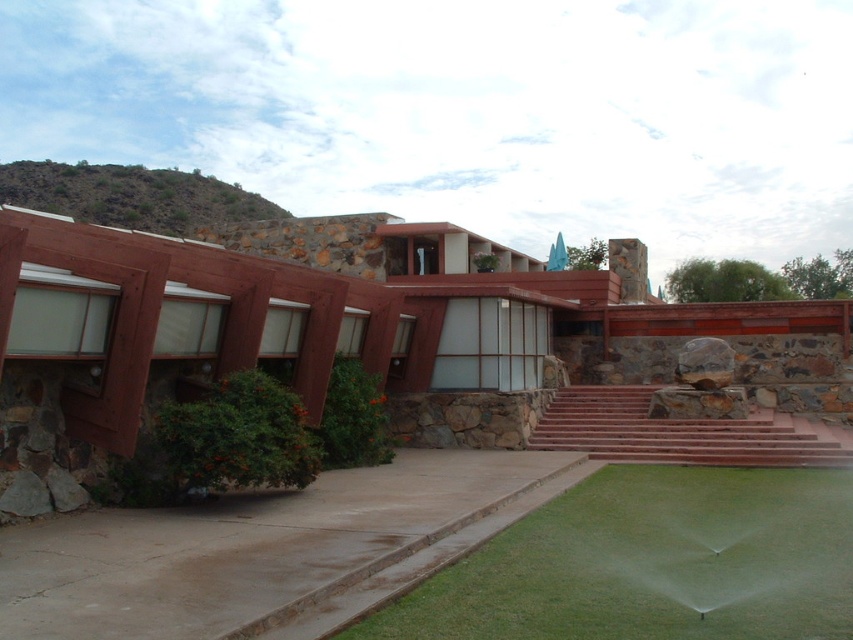
Question: Is brown wood pergola at center in front of green grass at lower center?

Choices:
 (A) no
 (B) yes

Answer: (A)

Question: Among these points, which one is farthest from the camera?

Choices:
 (A) (560, 634)
 (B) (646, 333)

Answer: (B)

Question: Which object appears farthest from the camera in this image?

Choices:
 (A) green grass at lower center
 (B) brown wood pergola at center

Answer: (B)

Question: Does brown wood pergola at center appear on the right side of green grass at lower center?

Choices:
 (A) no
 (B) yes

Answer: (A)

Question: Which point appears closest to the camera in this image?

Choices:
 (A) [846, 358]
 (B) [704, 616]

Answer: (B)

Question: Does brown wood pergola at center lie behind green grass at lower center?

Choices:
 (A) no
 (B) yes

Answer: (B)